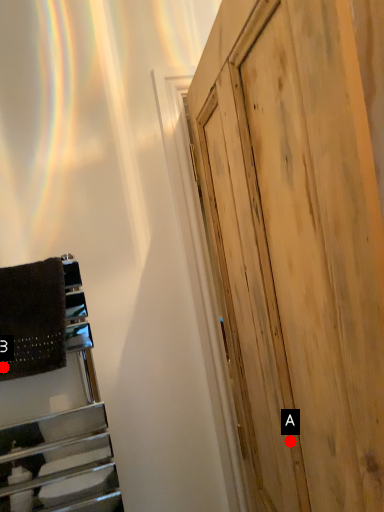
Question: Two points are circled on the image, labeled by A and B beside each circle. Among these points, which one is nearest to the camera?

Choices:
 (A) A is closer
 (B) B is closer

Answer: (A)